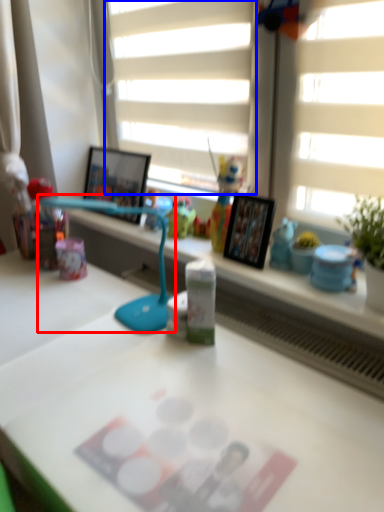
Question: Among these objects, which one is nearest to the camera, table lamp (highlighted by a red box) or blind (highlighted by a blue box)?

Choices:
 (A) table lamp
 (B) blind

Answer: (A)